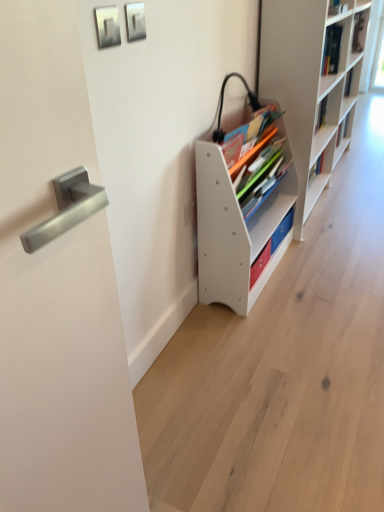
I want to click on free space in front of white plastic shelf at center, the 1th shelf viewed from the left, so click(269, 333).